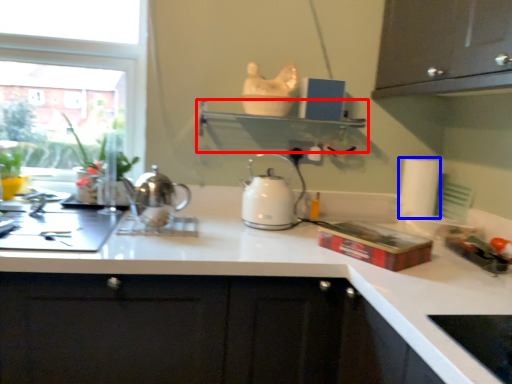
Question: Which point is closer to the camera, shelf (highlighted by a red box) or paper towel (highlighted by a blue box)?

Choices:
 (A) shelf
 (B) paper towel

Answer: (A)